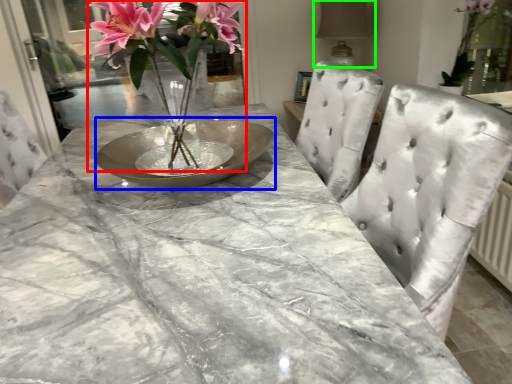
Question: Based on their relative distances, which object is nearer to floral arrangement (highlighted by a red box)? Choose from glass plate (highlighted by a blue box) and lamp (highlighted by a green box).

Choices:
 (A) glass plate
 (B) lamp

Answer: (A)